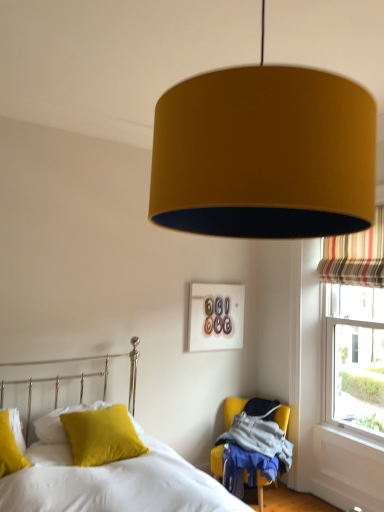
What do you see at coordinates (60, 422) in the screenshot?
I see `velvet yellow pillow at lower left, the 1th pillow viewed from the back` at bounding box center [60, 422].

Where is `mustard fabric lampshade at upper center`? mustard fabric lampshade at upper center is located at coordinates (264, 154).

The image size is (384, 512). Describe the element at coordinates (102, 436) in the screenshot. I see `matte yellow pillow at lower left, the second pillow when ordered from back to front` at that location.

Locate an element on the screen. This screenshot has width=384, height=512. velvet yellow pillow at lower left, the 1th pillow viewed from the back is located at coordinates (60, 422).

Is mustard fabric chair at lower right in front of or behind matte yellow pillow at lower left, the second pillow from the front, in the image?

mustard fabric chair at lower right is positioned farther from the viewer than matte yellow pillow at lower left, the second pillow from the front.

Can you confirm if mustard fabric chair at lower right is bigger than matte yellow pillow at lower left, the second pillow when ordered from back to front?

Yes.

Between mustard fabric chair at lower right and matte yellow pillow at lower left, the second pillow from the front, which one has larger width?

Wider between the two is mustard fabric chair at lower right.

Is mustard fabric chair at lower right not within matte yellow pillow at lower left, the second pillow from the front?

Indeed, mustard fabric chair at lower right is completely outside matte yellow pillow at lower left, the second pillow from the front.

Is matte yellow pillow at lower left, the second pillow from the front, not near velvet yellow pillow at lower left, the 1th pillow viewed from the back?

matte yellow pillow at lower left, the second pillow from the front, is actually quite close to velvet yellow pillow at lower left, the 1th pillow viewed from the back.

From the image's perspective, is matte yellow pillow at lower left, the second pillow when ordered from back to front, on top of velvet yellow pillow at lower left, the 1th pillow viewed from the back?

Result: Yes, from the image's perspective, matte yellow pillow at lower left, the second pillow when ordered from back to front, is on top of velvet yellow pillow at lower left, the 1th pillow viewed from the back.

Considering the positions of point (76, 450) and point (42, 439), is point (76, 450) closer or farther from the camera than point (42, 439)?

Clearly, point (76, 450) is closer to the camera than point (42, 439).

In terms of height, does matte yellow pillow at lower left, the second pillow from the front, look taller or shorter compared to velvet yellow pillow at lower left, which is the 3th pillow from front to back?

matte yellow pillow at lower left, the second pillow from the front, is taller than velvet yellow pillow at lower left, which is the 3th pillow from front to back.

Are mustard fabric chair at lower right and mustard fabric lampshade at upper center beside each other?

mustard fabric chair at lower right is not next to mustard fabric lampshade at upper center, and they're not touching.

In terms of height, does mustard fabric chair at lower right look taller or shorter compared to mustard fabric lampshade at upper center?

Clearly, mustard fabric chair at lower right is shorter compared to mustard fabric lampshade at upper center.

Locate an element on the screen. lamp that is on the left side of mustard fabric chair at lower right is located at coordinates (264, 154).

Which is closer to the camera, (229, 403) or (252, 212)?

Point (229, 403) appears to be farther away from the viewer than point (252, 212).

Between soft yellow pillow at lower left and velvet yellow pillow at lower left, which ranks as the third pillow in back-to-front order, which one has smaller size?

velvet yellow pillow at lower left, which ranks as the third pillow in back-to-front order.

Is soft yellow pillow at lower left to the right of velvet yellow pillow at lower left, which is the first pillow from front to back, from the viewer's perspective?

Yes, soft yellow pillow at lower left is to the right of velvet yellow pillow at lower left, which is the first pillow from front to back.

Is soft yellow pillow at lower left inside the boundaries of velvet yellow pillow at lower left, which is the first pillow from front to back, or outside?

soft yellow pillow at lower left is located beyond the bounds of velvet yellow pillow at lower left, which is the first pillow from front to back.

What's the angular difference between soft yellow pillow at lower left and velvet yellow pillow at lower left, which is the first pillow from front to back,'s facing directions?

The angle between the facing direction of soft yellow pillow at lower left and the facing direction of velvet yellow pillow at lower left, which is the first pillow from front to back, is 8.19 degrees.

From the picture: Is velvet yellow pillow at lower left, which is the first pillow from front to back, facing towards matte yellow pillow at lower left, the second pillow when ordered from back to front?

No, velvet yellow pillow at lower left, which is the first pillow from front to back, is not facing towards matte yellow pillow at lower left, the second pillow when ordered from back to front.

Can you confirm if velvet yellow pillow at lower left, which ranks as the third pillow in back-to-front order, is bigger than matte yellow pillow at lower left, the second pillow when ordered from back to front?

Incorrect, velvet yellow pillow at lower left, which ranks as the third pillow in back-to-front order, is not larger than matte yellow pillow at lower left, the second pillow when ordered from back to front.

Does velvet yellow pillow at lower left, which ranks as the third pillow in back-to-front order, touch matte yellow pillow at lower left, the second pillow when ordered from back to front?

No.

Can you tell me how much velvet yellow pillow at lower left, which is the first pillow from front to back, and matte yellow pillow at lower left, the second pillow when ordered from back to front, differ in facing direction?

They differ by 10.8 degrees in their facing directions.

Between soft yellow pillow at lower left and mustard fabric chair at lower right, which one has more height?

soft yellow pillow at lower left.

Is soft yellow pillow at lower left in contact with mustard fabric chair at lower right?

No, soft yellow pillow at lower left is not making contact with mustard fabric chair at lower right.

From the picture: From a real-world perspective, is soft yellow pillow at lower left physically located above or below mustard fabric chair at lower right?

From a real-world perspective, soft yellow pillow at lower left is physically above mustard fabric chair at lower right.

Consider the image. Considering the positions of objects soft yellow pillow at lower left and mustard fabric chair at lower right in the image provided, who is more to the right, soft yellow pillow at lower left or mustard fabric chair at lower right?

From the viewer's perspective, mustard fabric chair at lower right appears more on the right side.

Is matte yellow pillow at lower left, the second pillow when ordered from back to front, further to the viewer compared to soft yellow pillow at lower left?

Yes, matte yellow pillow at lower left, the second pillow when ordered from back to front, is further from the camera.

Between matte yellow pillow at lower left, the second pillow when ordered from back to front, and soft yellow pillow at lower left, which one has larger size?

Bigger between the two is soft yellow pillow at lower left.

Does matte yellow pillow at lower left, the second pillow from the front, turn towards soft yellow pillow at lower left?

Yes, matte yellow pillow at lower left, the second pillow from the front, is aimed at soft yellow pillow at lower left.

This screenshot has width=384, height=512. In order to click on chair on the right of matte yellow pillow at lower left, the second pillow from the front in this screenshot , I will do `click(232, 408)`.

From the image's perspective, which pillow is the 1st one above the velvet yellow pillow at lower left, the 1th pillow viewed from the back? Please provide its 2D coordinates.

[(102, 436)]

When comparing their distances from striped fabric curtain at right, does mustard fabric chair at lower right or velvet yellow pillow at lower left, which is the first pillow from front to back, seem further?

velvet yellow pillow at lower left, which is the first pillow from front to back, lies further to striped fabric curtain at right than the other object.

When comparing their distances from mustard fabric lampshade at upper center, does striped fabric curtain at right or mustard fabric chair at lower right seem further?

The object further to mustard fabric lampshade at upper center is mustard fabric chair at lower right.

Which object lies nearer to the anchor point velvet yellow pillow at lower left, the 1th pillow viewed from the back, striped fabric curtain at right or matte yellow pillow at lower left, the second pillow when ordered from back to front?

matte yellow pillow at lower left, the second pillow when ordered from back to front, is positioned closer to the anchor velvet yellow pillow at lower left, the 1th pillow viewed from the back.

Which object lies further to the anchor point matte yellow pillow at lower left, the second pillow when ordered from back to front, velvet yellow pillow at lower left, the 1th pillow viewed from the back, or velvet yellow pillow at lower left, which is the first pillow from front to back?

velvet yellow pillow at lower left, which is the first pillow from front to back, is positioned further to the anchor matte yellow pillow at lower left, the second pillow when ordered from back to front.

Considering their positions, is mustard fabric chair at lower right positioned closer to matte yellow pillow at lower left, the second pillow from the front, than soft yellow pillow at lower left?

soft yellow pillow at lower left is closer to matte yellow pillow at lower left, the second pillow from the front.

Based on their spatial positions, is matte yellow pillow at lower left, the second pillow when ordered from back to front, or soft yellow pillow at lower left further from mustard fabric lampshade at upper center?

matte yellow pillow at lower left, the second pillow when ordered from back to front.

Estimate the real-world distances between objects in this image. Which object is further from mustard fabric chair at lower right, mustard fabric lampshade at upper center or velvet yellow pillow at lower left, which ranks as the third pillow in back-to-front order?

mustard fabric lampshade at upper center.

Looking at the image, which one is located further to matte yellow pillow at lower left, the second pillow from the front, velvet yellow pillow at lower left, which ranks as the third pillow in back-to-front order, or soft yellow pillow at lower left?

Among the two, velvet yellow pillow at lower left, which ranks as the third pillow in back-to-front order, is located further to matte yellow pillow at lower left, the second pillow from the front.

At what (x,y) coordinates should I click in order to perform the action: click on pillow situated between velvet yellow pillow at lower left, which is the 3th pillow from front to back, and striped fabric curtain at right from left to right. Please return your answer as a coordinate pair (x, y). Image resolution: width=384 pixels, height=512 pixels. Looking at the image, I should click on (102, 436).

You are a GUI agent. You are given a task and a screenshot of the screen. Output one action in this format:
    pyautogui.click(x=<x>, y=<y>)
    Task: Click on the bed positioned between mustard fabric lampshade at upper center and matte yellow pillow at lower left, the second pillow when ordered from back to front, from near to far
    The height and width of the screenshot is (512, 384).
    Given the screenshot: What is the action you would take?
    pyautogui.click(x=109, y=480)

At what (x,y) coordinates should I click in order to perform the action: click on bed located between velvet yellow pillow at lower left, which is the first pillow from front to back, and striped fabric curtain at right in the left-right direction. Please return your answer as a coordinate pair (x, y). The image size is (384, 512). Looking at the image, I should click on (109, 480).

At what (x,y) coordinates should I click in order to perform the action: click on curtain between soft yellow pillow at lower left and mustard fabric chair at lower right in the front-back direction. Please return your answer as a coordinate pair (x, y). Looking at the image, I should click on (355, 256).